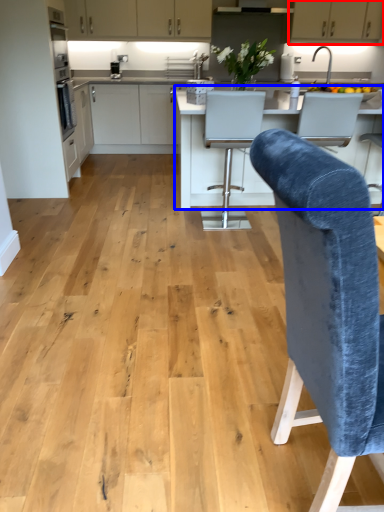
Question: Which point is closer to the camera, cabinetry (highlighted by a red box) or countertop (highlighted by a blue box)?

Choices:
 (A) cabinetry
 (B) countertop

Answer: (B)